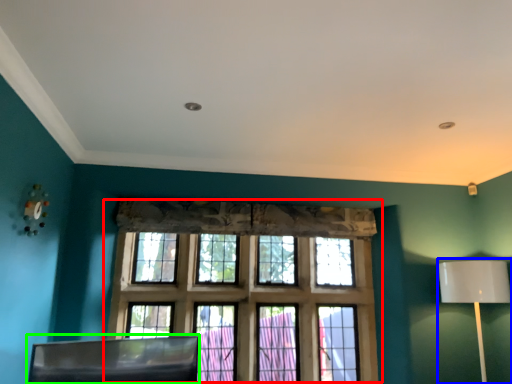
Question: Which is nearer to the window (highlighted by a red box)? table lamp (highlighted by a blue box) or swivel chair (highlighted by a green box).

Choices:
 (A) table lamp
 (B) swivel chair

Answer: (B)